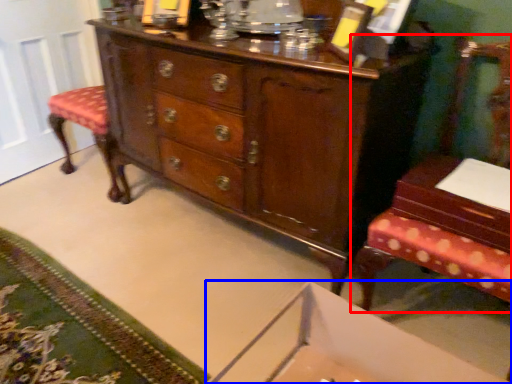
Question: Which of the following is the farthest to the observer, furniture (highlighted by a red box) or changing table (highlighted by a blue box)?

Choices:
 (A) furniture
 (B) changing table

Answer: (A)